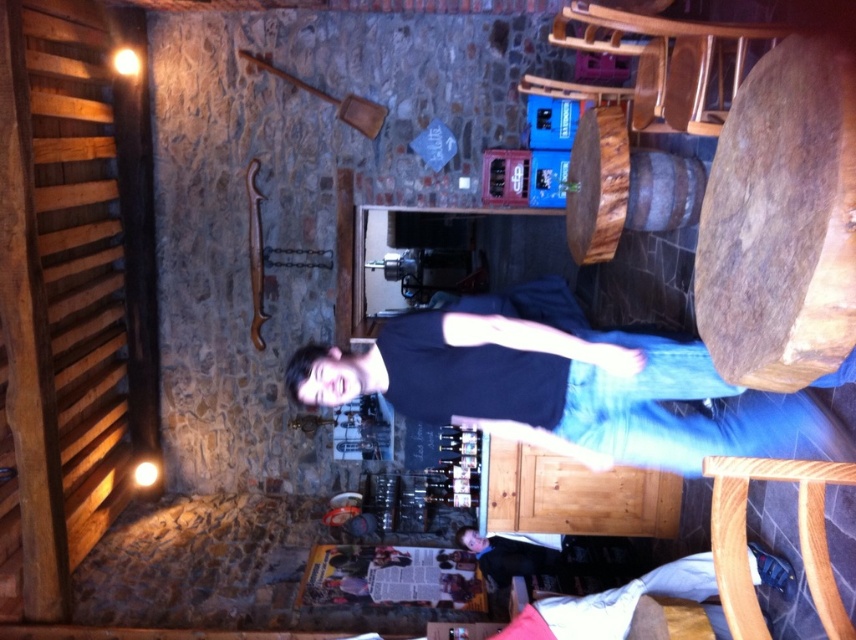
Image resolution: width=856 pixels, height=640 pixels. Describe the element at coordinates (560, 388) in the screenshot. I see `dark blue t-shirt at center` at that location.

I want to click on dark blue t-shirt at center, so click(x=560, y=388).

Who is positioned more to the left, denim jeans at lower right or dark blue shirt at lower center?

From the viewer's perspective, dark blue shirt at lower center appears more on the left side.

Who is higher up, denim jeans at lower right or dark blue shirt at lower center?

Positioned higher is denim jeans at lower right.

Which is in front, point (566, 625) or point (483, 545)?

Point (566, 625)

The image size is (856, 640). In order to click on denim jeans at lower right in this screenshot , I will do `click(611, 604)`.

Which of these two, dark blue t-shirt at center or dark blue shirt at lower center, stands taller?

dark blue t-shirt at center is taller.

Does dark blue t-shirt at center have a greater height compared to dark blue shirt at lower center?

Yes, dark blue t-shirt at center is taller than dark blue shirt at lower center.

Does point (354, 388) come farther from viewer compared to point (542, 545)?

No.

Locate an element on the screen. Image resolution: width=856 pixels, height=640 pixels. dark blue t-shirt at center is located at coordinates (560, 388).